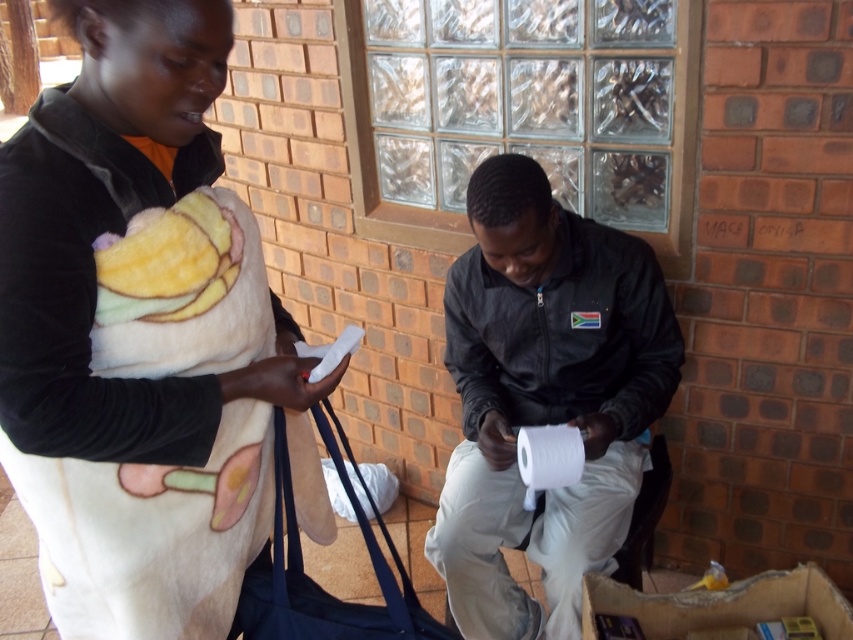
Question: Among these points, which one is nearest to the camera?

Choices:
 (A) (540, 508)
 (B) (163, 102)

Answer: (B)

Question: Considering the relative positions of white matte toilet paper at center and white soft blanket at upper left in the image provided, where is white matte toilet paper at center located with respect to white soft blanket at upper left?

Choices:
 (A) right
 (B) left

Answer: (A)

Question: Which point appears farthest from the camera in this image?

Choices:
 (A) (456, 577)
 (B) (137, 179)

Answer: (A)

Question: Which point is farther to the camera?

Choices:
 (A) (154, 61)
 (B) (537, 316)

Answer: (B)

Question: Does white matte toilet paper at center appear over white soft blanket at upper left?

Choices:
 (A) no
 (B) yes

Answer: (A)

Question: Is white matte toilet paper at center further to camera compared to white soft blanket at upper left?

Choices:
 (A) no
 (B) yes

Answer: (B)